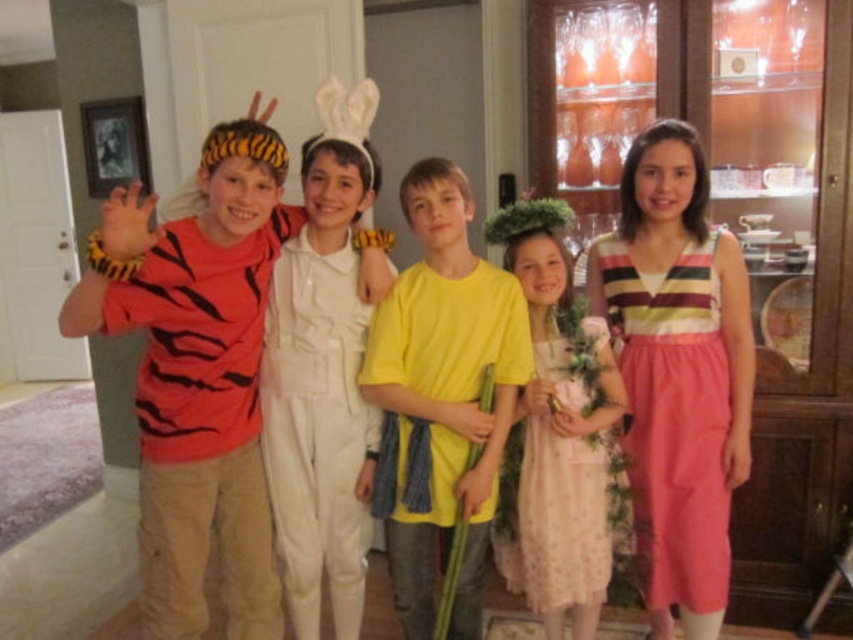
Question: Estimate the real-world distances between objects in this image. Which object is farther from the white cotton jumpsuit at center?

Choices:
 (A) yellow matte shirt at center
 (B) tiger-striped fabric shirt at left
 (C) pink cotton dress at right
 (D) pink floral dress at center

Answer: (C)

Question: Does tiger-striped fabric shirt at left come in front of yellow matte shirt at center?

Choices:
 (A) no
 (B) yes

Answer: (B)

Question: Among these points, which one is nearest to the camera?

Choices:
 (A) (554, 428)
 (B) (286, 579)
 (C) (704, 442)

Answer: (A)

Question: Which of the following is the farthest from the observer?

Choices:
 (A) (688, 417)
 (B) (595, 586)
 (C) (376, 342)

Answer: (A)

Question: Can you confirm if tiger-striped fabric shirt at left is bigger than pink floral dress at center?

Choices:
 (A) no
 (B) yes

Answer: (A)

Question: Is yellow matte shirt at center further to camera compared to white cotton jumpsuit at center?

Choices:
 (A) yes
 (B) no

Answer: (B)